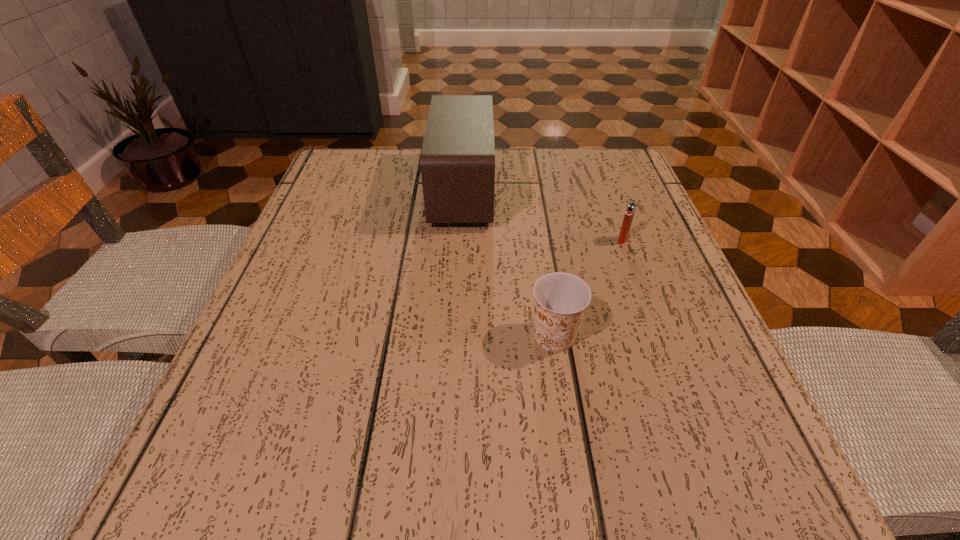
What are the coordinates of `free point that satisfies the following two spatial constraints: 1. on the back side of the rightmost object; 2. on the right side of the Dixie cup` in the screenshot? It's located at (540, 240).

You are a GUI agent. You are given a task and a screenshot of the screen. Output one action in this format:
    pyautogui.click(x=<x>, y=<y>)
    Task: Click on the vacant space that satisfies the following two spatial constraints: 1. on the back side of the igniter; 2. on the left side of the second object from left to right
    
    Given the screenshot: What is the action you would take?
    pyautogui.click(x=540, y=240)

Image resolution: width=960 pixels, height=540 pixels. What are the coordinates of `free space that satisfies the following two spatial constraints: 1. on the front-facing side of the radio receiver; 2. on the right side of the second object from left to right` in the screenshot? It's located at tap(455, 336).

Where is `vacant space that satisfies the following two spatial constraints: 1. on the front-facing side of the radio receiver; 2. on the right side of the igniter`? This screenshot has width=960, height=540. vacant space that satisfies the following two spatial constraints: 1. on the front-facing side of the radio receiver; 2. on the right side of the igniter is located at coordinates (460, 240).

Image resolution: width=960 pixels, height=540 pixels. What are the coordinates of `free point that satisfies the following two spatial constraints: 1. on the front-facing side of the farthest object; 2. on the right side of the second farthest object` in the screenshot? It's located at (460, 240).

At what (x,y) coordinates should I click in order to perform the action: click on free region that satisfies the following two spatial constraints: 1. on the back side of the second object from right to left; 2. on the left side of the igniter. Please return your answer as a coordinate pair (x, y). Image resolution: width=960 pixels, height=540 pixels. Looking at the image, I should click on (540, 240).

The height and width of the screenshot is (540, 960). Find the location of `vacant space that satisfies the following two spatial constraints: 1. on the front-facing side of the Dixie cup; 2. on the left side of the tallest object`. vacant space that satisfies the following two spatial constraints: 1. on the front-facing side of the Dixie cup; 2. on the left side of the tallest object is located at coordinates (455, 336).

The height and width of the screenshot is (540, 960). I want to click on vacant area in the image that satisfies the following two spatial constraints: 1. on the back side of the rightmost object; 2. on the front-facing side of the radio receiver, so click(x=604, y=191).

Identify the location of free space that satisfies the following two spatial constraints: 1. on the front-facing side of the shortest object; 2. on the left side of the tallest object. The width and height of the screenshot is (960, 540). (460, 240).

Locate an element on the screen. free space that satisfies the following two spatial constraints: 1. on the front-facing side of the second object from left to right; 2. on the right side of the farthest object is located at coordinates (455, 336).